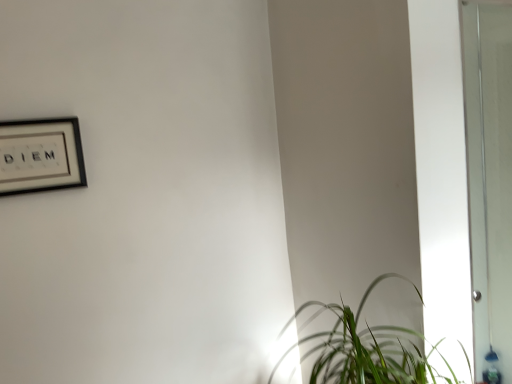
Question: From the image's perspective, is black matte picture frame at upper left above or below green leafy plant at lower right?

Choices:
 (A) below
 (B) above

Answer: (B)

Question: From their relative heights in the image, would you say black matte picture frame at upper left is taller or shorter than green leafy plant at lower right?

Choices:
 (A) tall
 (B) short

Answer: (B)

Question: Is black matte picture frame at upper left inside or outside of green leafy plant at lower right?

Choices:
 (A) inside
 (B) outside

Answer: (B)

Question: From the image's perspective, is green leafy plant at lower right above or below black matte picture frame at upper left?

Choices:
 (A) above
 (B) below

Answer: (B)

Question: Relative to black matte picture frame at upper left, is green leafy plant at lower right in front or behind?

Choices:
 (A) front
 (B) behind

Answer: (A)

Question: Would you say green leafy plant at lower right is to the left or to the right of black matte picture frame at upper left in the picture?

Choices:
 (A) left
 (B) right

Answer: (B)

Question: Considering the positions of green leafy plant at lower right and black matte picture frame at upper left in the image, is green leafy plant at lower right bigger or smaller than black matte picture frame at upper left?

Choices:
 (A) big
 (B) small

Answer: (A)